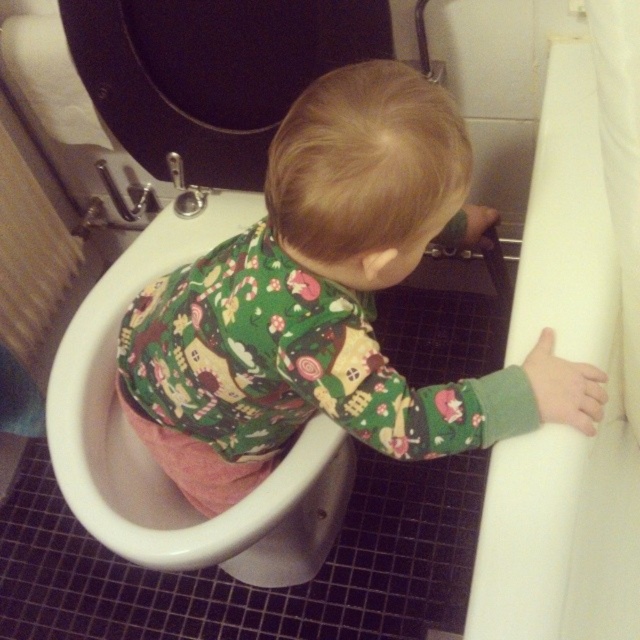
Does white glossy toilet bowl at center have a lesser width compared to black glossy toilet lid at upper center?

Indeed, white glossy toilet bowl at center has a lesser width compared to black glossy toilet lid at upper center.

Where is `white glossy toilet bowl at center`? This screenshot has width=640, height=640. white glossy toilet bowl at center is located at coordinates (150, 456).

Is white smooth bathtub at right taller than black glossy toilet lid at upper center?

Correct, white smooth bathtub at right is much taller as black glossy toilet lid at upper center.

Is white smooth bathtub at right positioned in front of black glossy toilet lid at upper center?

Yes, it is in front of black glossy toilet lid at upper center.

I want to click on white smooth bathtub at right, so click(563, 426).

Identify the location of white smooth bathtub at right. (563, 426).

Which is behind, point (285, 272) or point (74, 486)?

Point (74, 486)

Where is `green cotton pajamas at center`? This screenshot has width=640, height=640. green cotton pajamas at center is located at coordinates (328, 304).